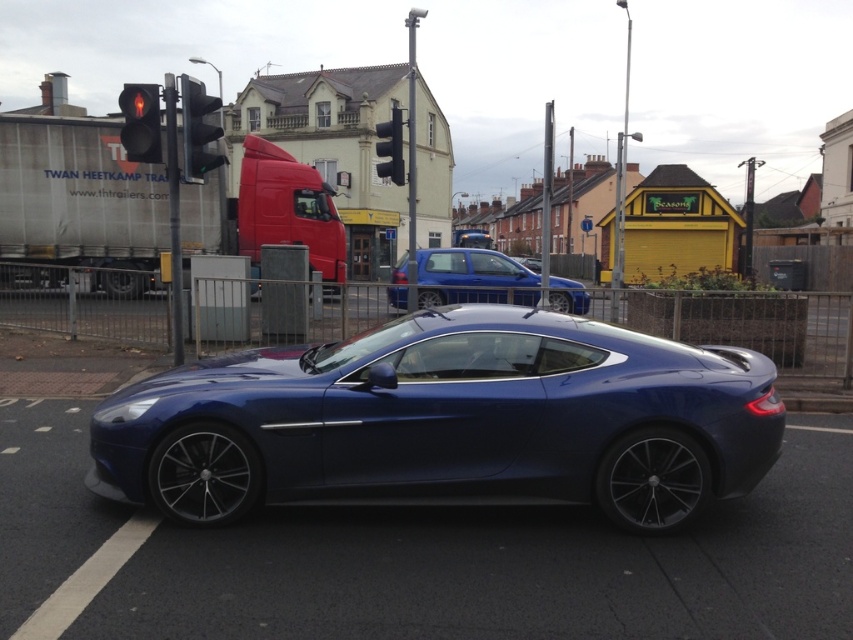
You are a driver approaching an intersection and see the metallic traffic light at upper center and the red glass traffic light at upper left. Which traffic light is smaller in size?

The metallic traffic light at upper center is smaller in size compared to the red glass traffic light at upper left.

You are a pedestrian standing on the sidewalk looking at the road. You see the metallic traffic light at upper center and the red glass traffic light at upper left. Which traffic light is closer to the road?

The metallic traffic light at upper center is positioned under the red glass traffic light at upper left, so the metallic traffic light at upper center is closer to the road.